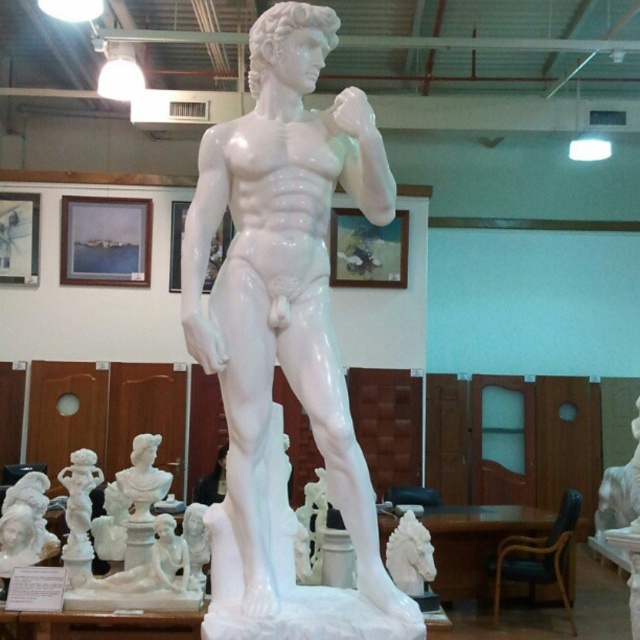
Measure the distance from white glossy statue at center to white glossy horse at lower center.

1.70 meters

Can you confirm if white glossy statue at center is positioned below white glossy horse at lower center?

Actually, white glossy statue at center is above white glossy horse at lower center.

The image size is (640, 640). Identify the location of white glossy statue at center. (288, 316).

Is point (8, 561) closer to camera compared to point (403, 573)?

No, (8, 561) is further to viewer.

This screenshot has width=640, height=640. In order to click on white marble bust at lower left in this screenshot , I will do `click(26, 524)`.

In the scene shown: Does white glossy cherub at lower left appear over white glossy horse at lower center?

Yes, white glossy cherub at lower left is above white glossy horse at lower center.

Can you confirm if white glossy cherub at lower left is shorter than white glossy horse at lower center?

No.

The height and width of the screenshot is (640, 640). In order to click on white glossy cherub at lower left in this screenshot , I will do `click(80, 506)`.

Where is `white glossy cherub at lower left`? The image size is (640, 640). white glossy cherub at lower left is located at coordinates (x=80, y=506).